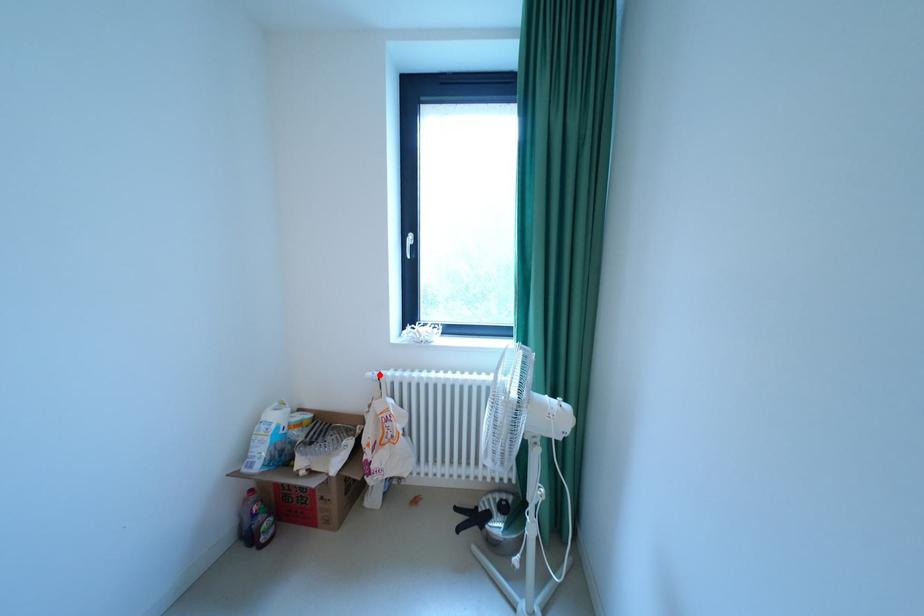
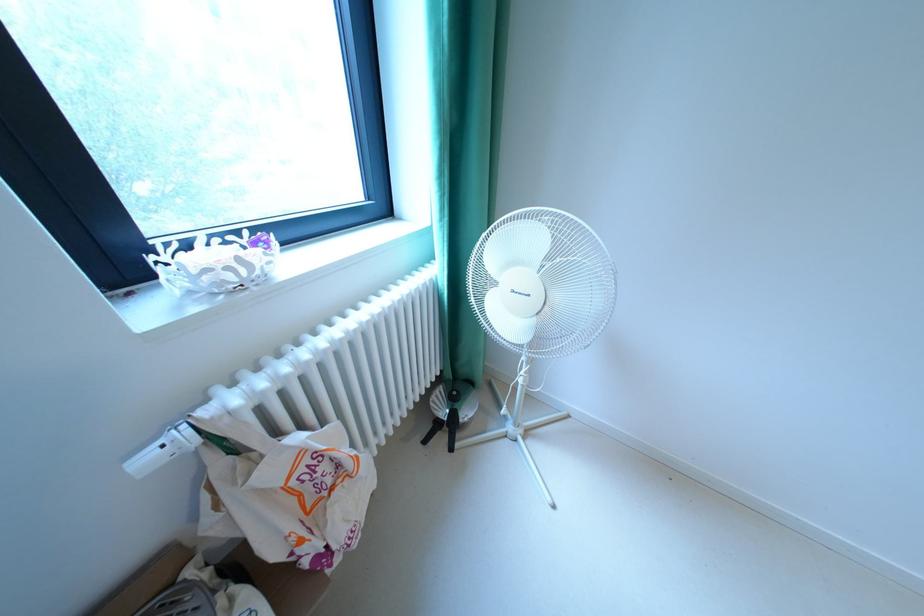
Locate, in the second image, the point that corresponds to the highlighted location in the first image.

(156, 460)